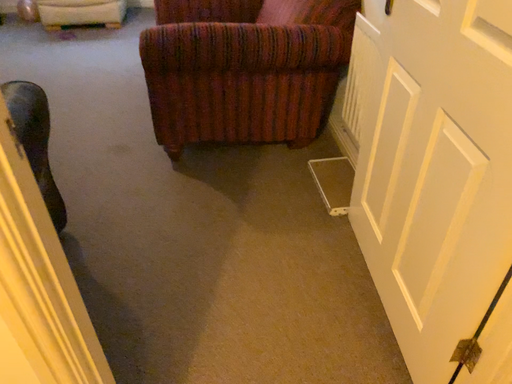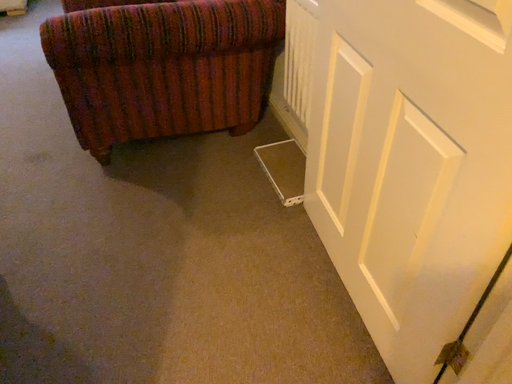
Question: Which way did the camera rotate in the video?

Choices:
 (A) rotated left
 (B) rotated right

Answer: (B)